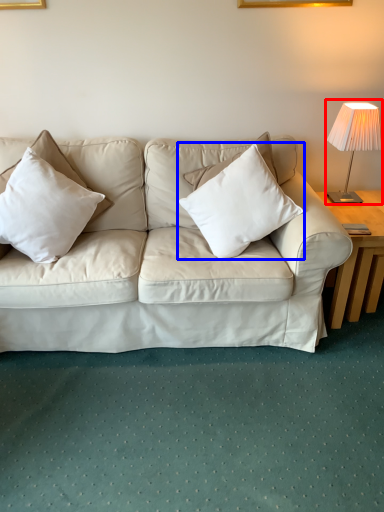
Question: Which object appears closest to the camera in this image, table lamp (highlighted by a red box) or pillow (highlighted by a blue box)?

Choices:
 (A) table lamp
 (B) pillow

Answer: (B)